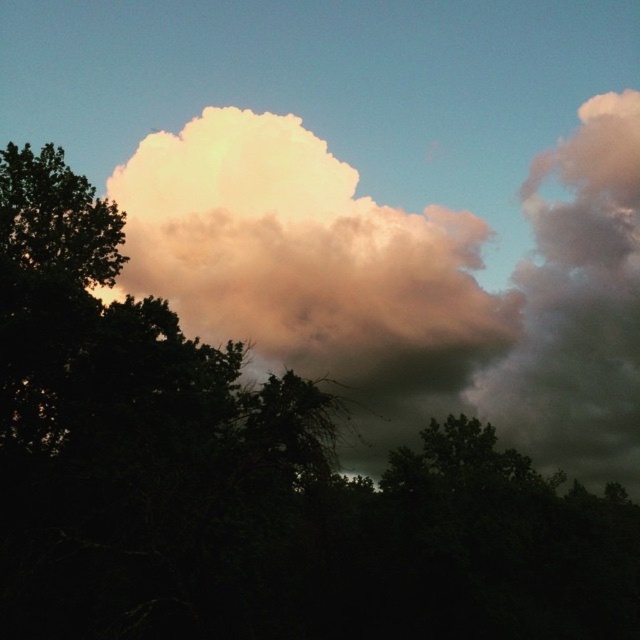
You are an astronomer observing the sky and notice the white fluffy cloud at upper center and the cloudy gray cloud at upper right. Which cloud is positioned higher in the sky?

The white fluffy cloud at upper center is positioned higher in the sky than the cloudy gray cloud at upper right.

You are standing in front of the dramatic sky scene with the silhouetted trees. You notice two points marked in the image. Which point is closer to you, point (348, 172) or point (636, 460)?

Point (348, 172) is closer to the viewer than point (636, 460).